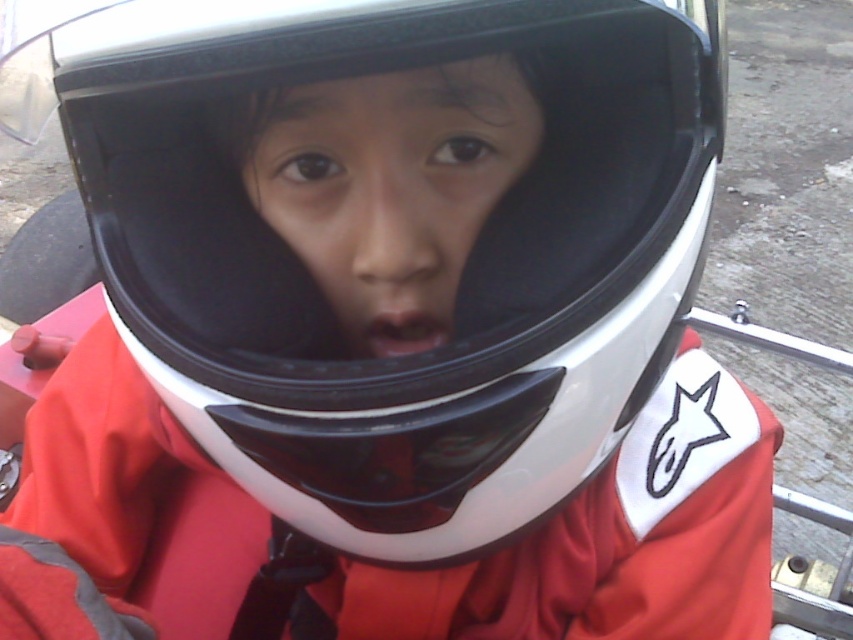
Is transparent matte plastic goggles at center in front of matte skin nose at center?

That is True.

What do you see at coordinates (395, 451) in the screenshot? The width and height of the screenshot is (853, 640). I see `transparent matte plastic goggles at center` at bounding box center [395, 451].

This screenshot has height=640, width=853. Identify the location of transparent matte plastic goggles at center. (395, 451).

Who is more distant from viewer, (485, 172) or (492, 440)?

Positioned behind is point (485, 172).

Does matte black helmet at center lie behind transparent matte plastic goggles at center?

Yes, it is.

Identify the location of matte black helmet at center. (387, 176).

Is point (444, 74) behind point (444, 326)?

No, it is not.

Find the location of a particular element. The width and height of the screenshot is (853, 640). matte black helmet at center is located at coordinates (387, 176).